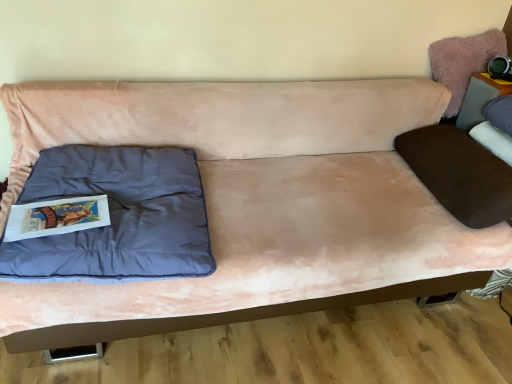
Question: Is matte blue pillow at left far from matte gray table at upper right?

Choices:
 (A) no
 (B) yes

Answer: (B)

Question: From the image's perspective, is matte blue pillow at left under matte gray table at upper right?

Choices:
 (A) yes
 (B) no

Answer: (A)

Question: From the image's perspective, would you say matte blue pillow at left is positioned over matte gray table at upper right?

Choices:
 (A) yes
 (B) no

Answer: (B)

Question: Can you confirm if matte blue pillow at left is smaller than matte gray table at upper right?

Choices:
 (A) yes
 (B) no

Answer: (B)

Question: From a real-world perspective, is matte blue pillow at left below matte gray table at upper right?

Choices:
 (A) yes
 (B) no

Answer: (A)

Question: Choose the correct answer: Is matte blue pillow at left inside pink suede couch at center or outside it?

Choices:
 (A) inside
 (B) outside

Answer: (A)

Question: Considering the positions of matte blue pillow at left and pink suede couch at center in the image, is matte blue pillow at left taller or shorter than pink suede couch at center?

Choices:
 (A) tall
 (B) short

Answer: (B)

Question: From the image's perspective, is matte blue pillow at left positioned above or below pink suede couch at center?

Choices:
 (A) below
 (B) above

Answer: (A)

Question: Relative to pink suede couch at center, is matte blue pillow at left in front or behind?

Choices:
 (A) behind
 (B) front

Answer: (A)

Question: Is point (326, 258) positioned closer to the camera than point (479, 104)?

Choices:
 (A) farther
 (B) closer

Answer: (B)

Question: Considering the positions of pink suede couch at center and matte gray table at upper right in the image, is pink suede couch at center taller or shorter than matte gray table at upper right?

Choices:
 (A) tall
 (B) short

Answer: (A)

Question: Considering their positions, is pink suede couch at center located in front of or behind matte gray table at upper right?

Choices:
 (A) front
 (B) behind

Answer: (A)

Question: From a real-world perspective, is pink suede couch at center above or below matte gray table at upper right?

Choices:
 (A) above
 (B) below

Answer: (B)

Question: From a real-world perspective, is matte blue pillow at left physically located above or below fuzzy pink pillow at upper right?

Choices:
 (A) below
 (B) above

Answer: (A)

Question: Considering the positions of matte blue pillow at left and fuzzy pink pillow at upper right in the image, is matte blue pillow at left taller or shorter than fuzzy pink pillow at upper right?

Choices:
 (A) short
 (B) tall

Answer: (A)